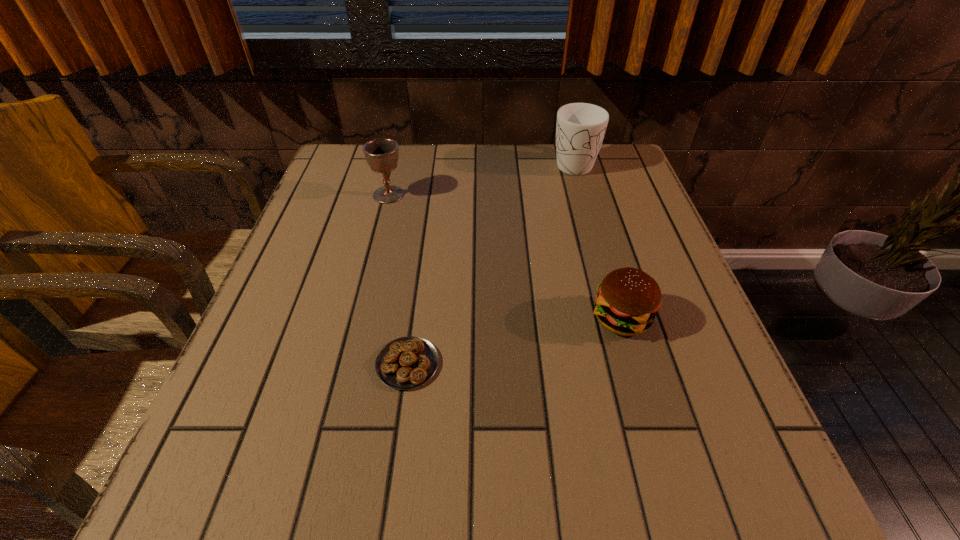
This screenshot has height=540, width=960. I want to click on free space at the right edge of the desktop, so click(x=668, y=357).

In order to click on vacant space at the far right corner in this screenshot , I will do `click(633, 174)`.

What are the coordinates of `vacant space at the near right corner` in the screenshot? It's located at (723, 500).

Identify the location of empty space between the mug and the pastry. (491, 263).

Find the location of a particular element. This screenshot has width=960, height=540. free space between the shortest object and the third nearest object is located at coordinates (398, 279).

You are a GUI agent. You are given a task and a screenshot of the screen. Output one action in this format:
    pyautogui.click(x=<x>, y=<y>)
    Task: Click on the free space between the farthest object and the second shortest object
    This screenshot has height=540, width=960.
    Given the screenshot: What is the action you would take?
    pyautogui.click(x=597, y=240)

I want to click on free point between the third tallest object and the leftmost object, so click(x=505, y=256).

The image size is (960, 540). Find the location of `vacant space that's between the farthest object and the hamburger`. vacant space that's between the farthest object and the hamburger is located at coordinates (597, 240).

Where is `free space between the farthest object and the third object from right to left`? free space between the farthest object and the third object from right to left is located at coordinates (491, 263).

Identify the location of unoccupied position between the mug and the second shortest object. Image resolution: width=960 pixels, height=540 pixels. (597, 240).